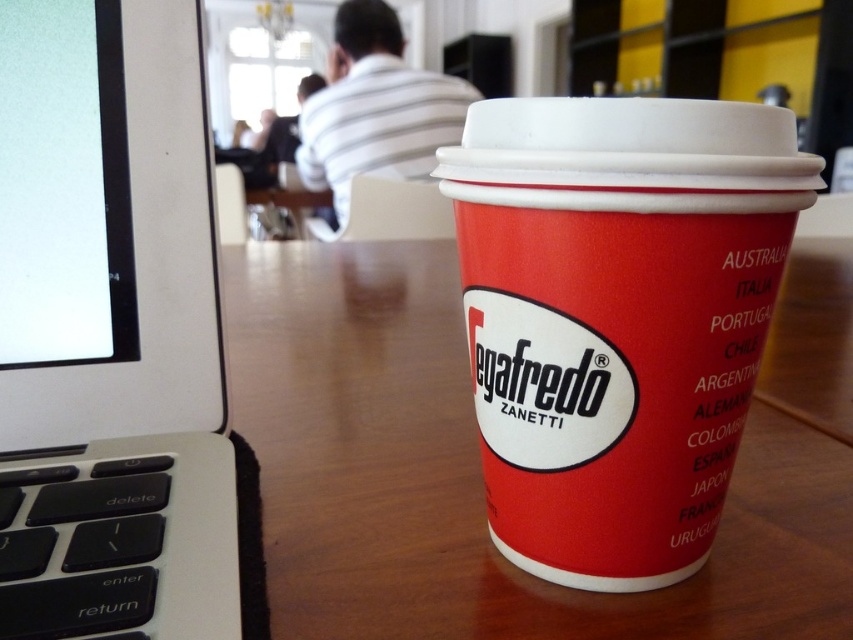
You are organizing items on a wooden table and need to place the white plastic laptop at left. Where exactly should you position it to match the original image?

The white plastic laptop at left should be positioned at point coordinates [109,328] to match the original image.

You are organizing a small event and need to place a decorative item on the wooden table at center. However, there is already a red matte segafredo cup at center on it. Can the cup be placed under the table to make space?

The wooden table at center is above the red matte segafredo cup at center, so the cup is already under the table. Therefore, moving it further under might not be possible as it is already positioned there.